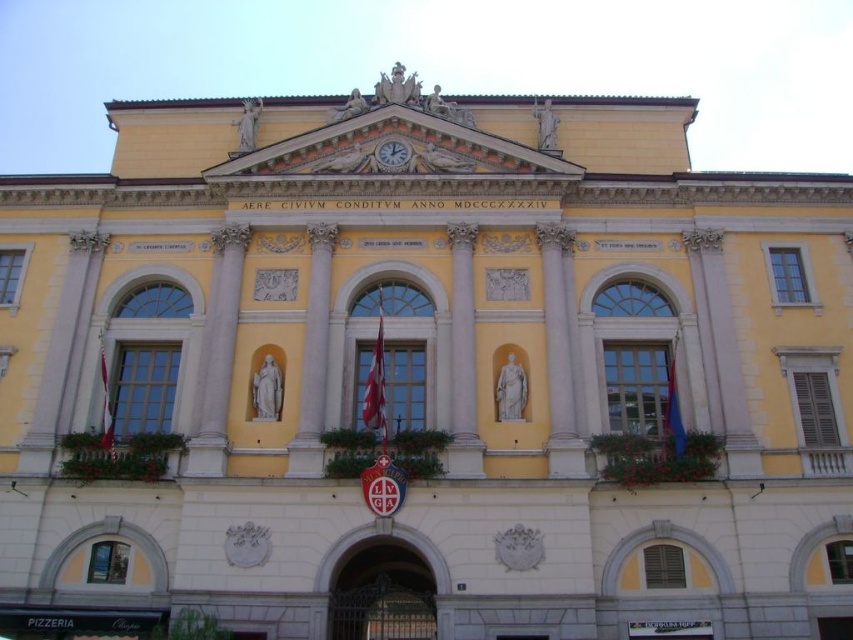
In the scene shown: You are an architect planning to install a new decorative element between the white marble pillar at center and the white marble statue at center. The decorative element requires a minimum of 5 meters of space. Based on the scene, will there be enough space for this installation?

The distance between the white marble pillar at center and the white marble statue at center is 5.23 meters. Since the decorative element requires a minimum of 5 meters, there is sufficient space for the installation.

You are an architect examining the building facade. You need to determine the relative heights of the white marble pillar at center and the gold metallic clock at upper center. Based on the scene, which object is taller?

The white marble pillar at center is taller than the gold metallic clock at upper center.